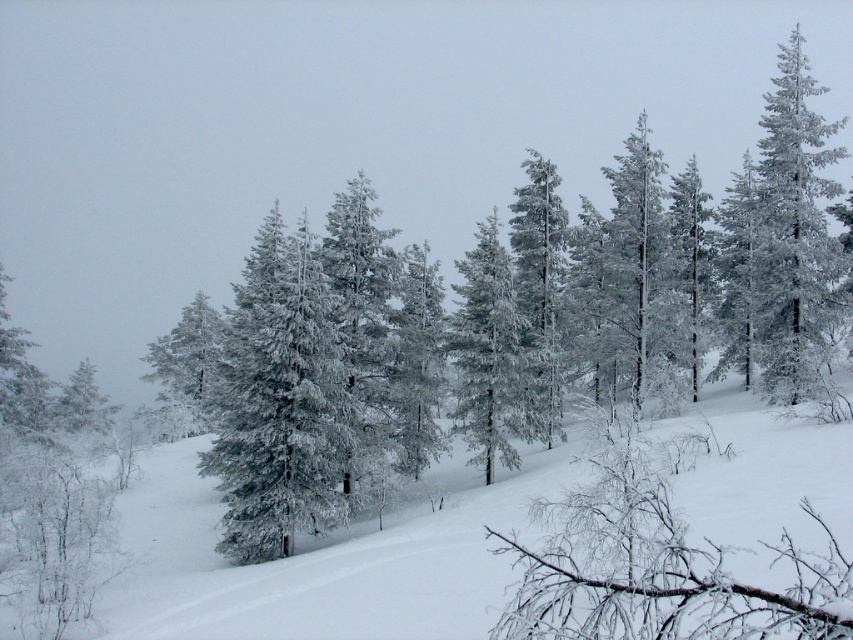
Which is more to the left, snow-covered evergreen at center or white frosty tree at left?

Positioned to the left is white frosty tree at left.

You are a GUI agent. You are given a task and a screenshot of the screen. Output one action in this format:
    pyautogui.click(x=<x>, y=<y>)
    Task: Click on the snow-covered evergreen at center
    
    Given the screenshot: What is the action you would take?
    pyautogui.click(x=277, y=401)

Which is behind, point (323, 288) or point (190, 385)?

Point (190, 385)

What are the coordinates of `snow-covered evergreen at center` in the screenshot? It's located at (277, 401).

Looking at this image, does white frosty tree at center have a larger size compared to snow-covered pine at center?

No, white frosty tree at center is not bigger than snow-covered pine at center.

Who is taller, white frosty tree at center or snow-covered pine at center?

With more height is snow-covered pine at center.

Between point (466, 282) and point (540, 216), which one is positioned behind?

The point (466, 282) is behind.

Locate an element on the screen. Image resolution: width=853 pixels, height=640 pixels. white frosty tree at center is located at coordinates (486, 353).

Does snow-covered evergreen at center have a greater height compared to white frosty tree at center?

Yes.

Which of these two, snow-covered evergreen at center or white frosty tree at center, stands shorter?

white frosty tree at center

Identify the location of snow-covered evergreen at center. This screenshot has height=640, width=853. (277, 401).

Where is `snow-covered evergreen at center`? The width and height of the screenshot is (853, 640). snow-covered evergreen at center is located at coordinates (277, 401).